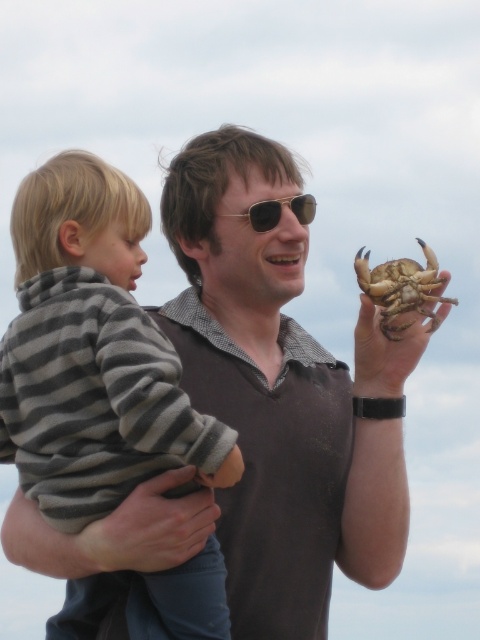
Question: Is striped fleece sweater at left bigger than gold metallic sunglasses at center?

Choices:
 (A) yes
 (B) no

Answer: (A)

Question: Which is farther from the gold metallic sunglasses at center?

Choices:
 (A) brown textured crab claw at upper right
 (B) striped fleece sweater at left

Answer: (B)

Question: Which point is farther to the camera?

Choices:
 (A) brown hard shell crab at upper right
 (B) gold metallic sunglasses at center

Answer: (B)

Question: Can you confirm if brown textured crab claw at upper right is wider than gold metallic sunglasses at center?

Choices:
 (A) yes
 (B) no

Answer: (B)

Question: Is brown textured crab claw at upper right closer to camera compared to brown hard shell crab at upper right?

Choices:
 (A) yes
 (B) no

Answer: (A)

Question: Among these objects, which one is nearest to the camera?

Choices:
 (A) brown hard shell crab at upper right
 (B) striped fleece sweater at left
 (C) gold metallic sunglasses at center

Answer: (B)